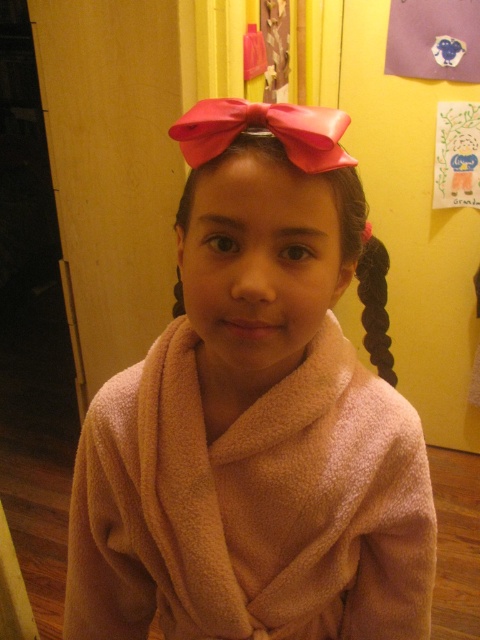
Question: Which object appears farthest from the camera in this image?

Choices:
 (A) black silky hair at right
 (B) pink satin bow at upper center
 (C) pink fluffy robe at center
 (D) pink satin bow at center

Answer: (A)

Question: Does pink satin bow at upper center have a lesser width compared to pink satin bow at center?

Choices:
 (A) no
 (B) yes

Answer: (B)

Question: Considering the real-world distances, which object is farthest from the pink satin bow at upper center?

Choices:
 (A) black silky hair at right
 (B) pink satin bow at center
 (C) pink fluffy robe at center

Answer: (A)

Question: Can you confirm if pink satin bow at upper center is smaller than black silky hair at right?

Choices:
 (A) yes
 (B) no

Answer: (A)

Question: Which of these objects is positioned farthest from the pink fluffy robe at center?

Choices:
 (A) pink satin bow at upper center
 (B) black silky hair at right

Answer: (B)

Question: Does pink satin bow at upper center have a lesser width compared to black silky hair at right?

Choices:
 (A) yes
 (B) no

Answer: (A)